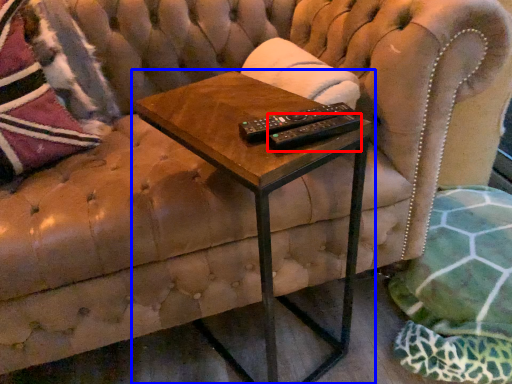
Question: Which point is closer to the camera, remote (highlighted by a red box) or table (highlighted by a blue box)?

Choices:
 (A) remote
 (B) table

Answer: (B)